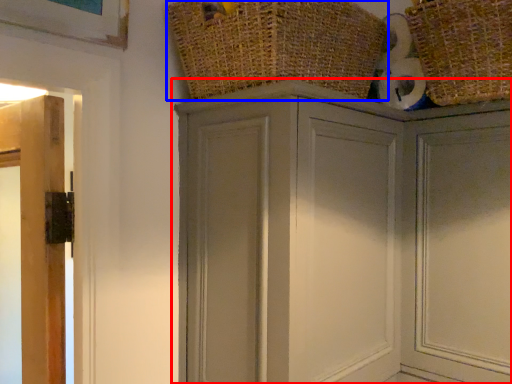
Question: Among these objects, which one is farthest to the camera, cupboard (highlighted by a red box) or basket (highlighted by a blue box)?

Choices:
 (A) cupboard
 (B) basket

Answer: (A)